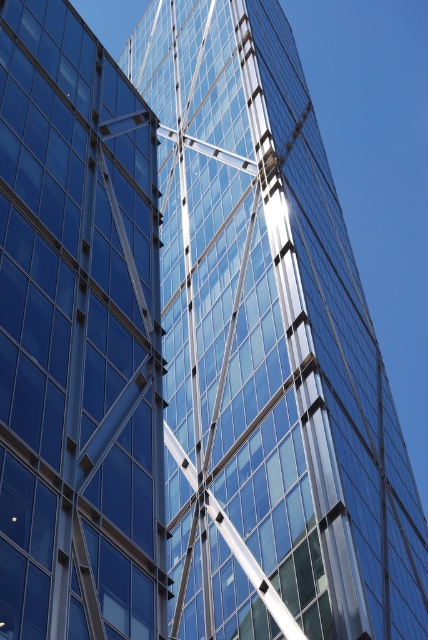
You are a drone operator planning to fly a drone between the transparent glass building at center and the transparent glass building at left. The drone has a wingspan of 2 meters. Based on the scene, can the drone safely pass through the space between them?

The distance between the transparent glass building at center and the transparent glass building at left is 26.12 meters, which is more than sufficient for the drone with a 2 meter wingspan to safely pass through.